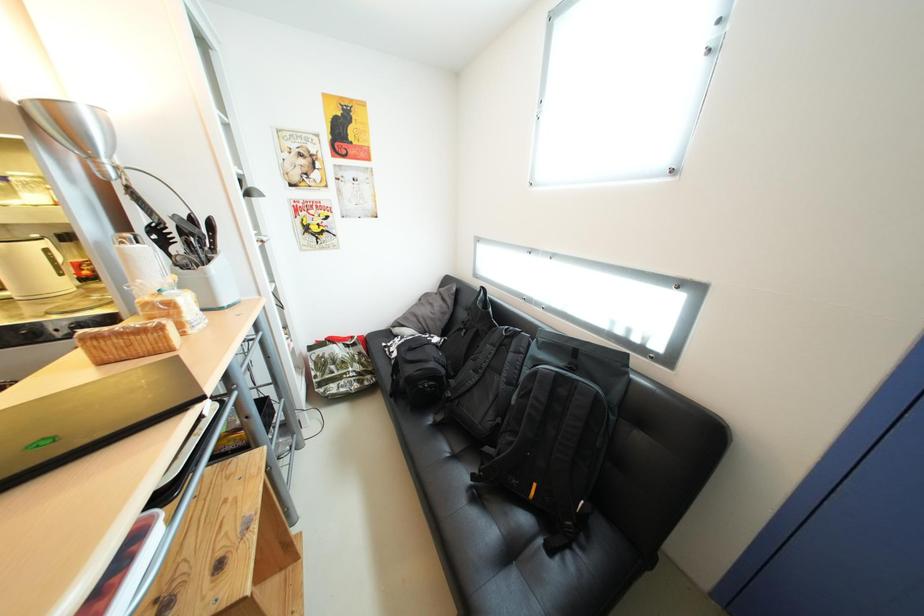
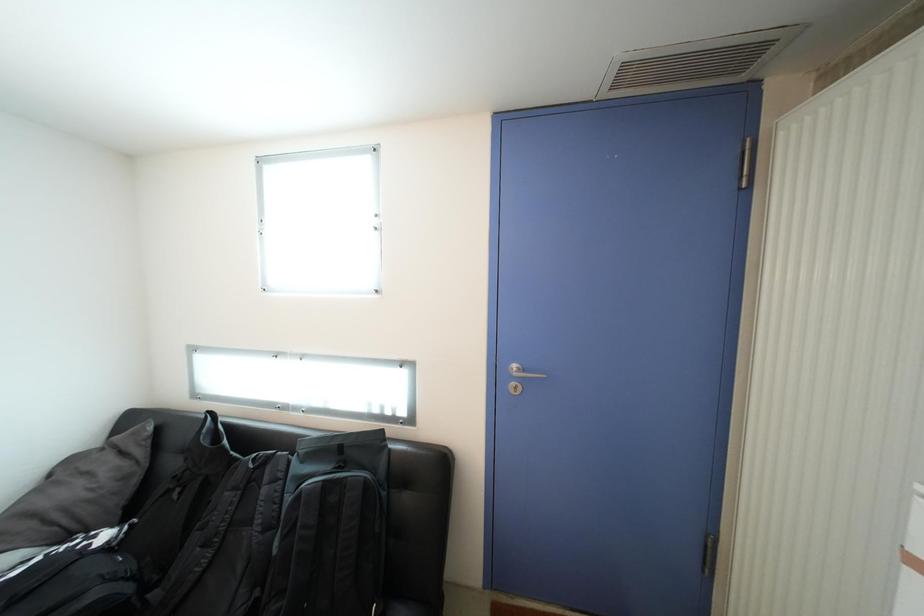
Question: How did the camera likely rotate?

Choices:
 (A) Left
 (B) Right
 (C) Up
 (D) Down

Answer: (B)